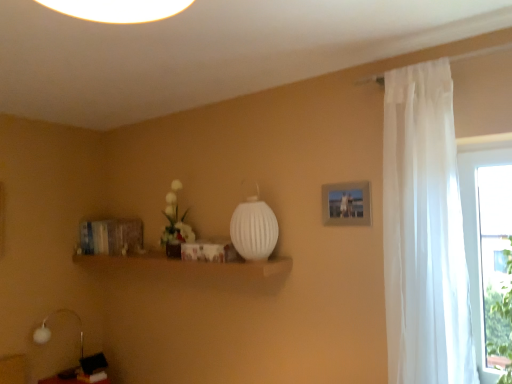
Question: Are green leafy plant at right and white sheer curtain at right located far from each other?

Choices:
 (A) yes
 (B) no

Answer: (B)

Question: Is green leafy plant at right shorter than white sheer curtain at right?

Choices:
 (A) no
 (B) yes

Answer: (B)

Question: From the image's perspective, is green leafy plant at right under white sheer curtain at right?

Choices:
 (A) no
 (B) yes

Answer: (B)

Question: From a real-world perspective, is green leafy plant at right on white sheer curtain at right?

Choices:
 (A) yes
 (B) no

Answer: (B)

Question: Is green leafy plant at right in contact with white sheer curtain at right?

Choices:
 (A) no
 (B) yes

Answer: (A)

Question: Is green leafy plant at right at the right side of white sheer curtain at right?

Choices:
 (A) yes
 (B) no

Answer: (A)

Question: Is matte silver picture frame at upper right closer to camera compared to green leafy plant at right?

Choices:
 (A) yes
 (B) no

Answer: (B)

Question: From a real-world perspective, is matte silver picture frame at upper right over green leafy plant at right?

Choices:
 (A) no
 (B) yes

Answer: (B)

Question: Can you confirm if matte silver picture frame at upper right is smaller than green leafy plant at right?

Choices:
 (A) no
 (B) yes

Answer: (B)

Question: Can you confirm if matte silver picture frame at upper right is bigger than green leafy plant at right?

Choices:
 (A) yes
 (B) no

Answer: (B)

Question: Considering the relative sizes of matte silver picture frame at upper right and green leafy plant at right in the image provided, is matte silver picture frame at upper right wider than green leafy plant at right?

Choices:
 (A) yes
 (B) no

Answer: (B)

Question: Could you tell me if matte silver picture frame at upper right is turned towards green leafy plant at right?

Choices:
 (A) no
 (B) yes

Answer: (A)

Question: Does white ribbed glass vase at center have a larger size compared to white sheer curtain at right?

Choices:
 (A) no
 (B) yes

Answer: (A)